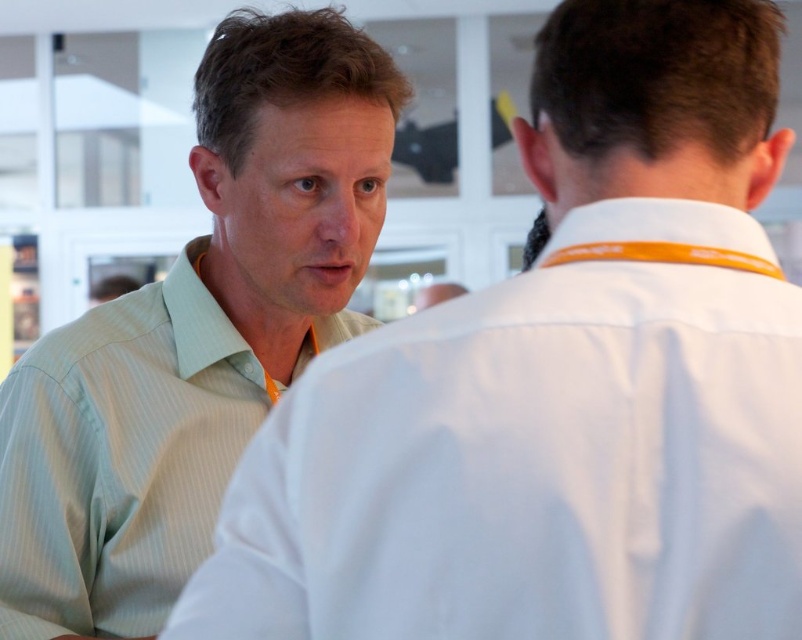
Question: Which object appears farthest from the camera in this image?

Choices:
 (A) light green striped shirt at left
 (B) orange fabric neckband at upper center

Answer: (A)

Question: From the image, what is the correct spatial relationship of light green striped shirt at left in relation to orange fabric neckband at upper center?

Choices:
 (A) left
 (B) right

Answer: (A)

Question: Which object appears farthest from the camera in this image?

Choices:
 (A) light green striped shirt at left
 (B) orange fabric neckband at upper center

Answer: (A)

Question: Observing the image, what is the correct spatial positioning of light green striped shirt at left in reference to orange fabric neckband at upper center?

Choices:
 (A) left
 (B) right

Answer: (A)

Question: Which of the following is the closest to the observer?

Choices:
 (A) light green striped shirt at left
 (B) orange fabric neckband at upper center

Answer: (B)

Question: In this image, where is light green striped shirt at left located relative to orange fabric neckband at upper center?

Choices:
 (A) right
 (B) left

Answer: (B)